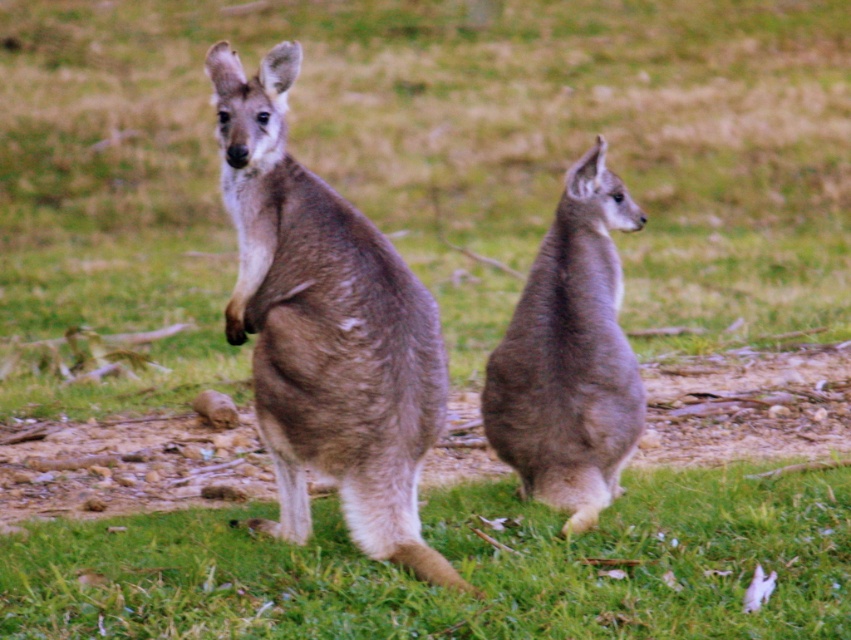
You are a small animal trying to jump from the green soft grass at lower center to the gray fur kangaroo at center. Can you make the jump if your maximum jump distance is 24 inches?

The green soft grass at lower center is 23.97 inches away from gray fur kangaroo at center, so yes, the small animal can make the jump since the distance is within its maximum jump capability of 24 inches.

You are a small rabbit trying to hide from a predator. You see the green soft grass at lower center and the gray fur kangaroo at center. Which location would provide better concealment?

The green soft grass at lower center would provide better concealment because it is shorter than the gray fur kangaroo at center, making it easier to hide among the grass.